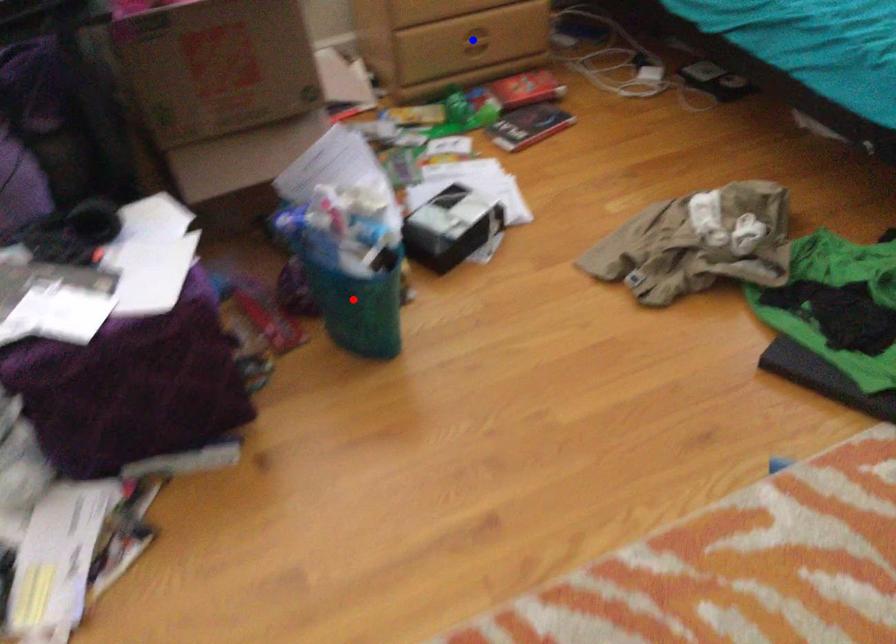
Question: In the image, two points are highlighted. Which point is nearer to the camera? Reply with the corresponding letter.

Choices:
 (A) blue point
 (B) red point

Answer: (B)